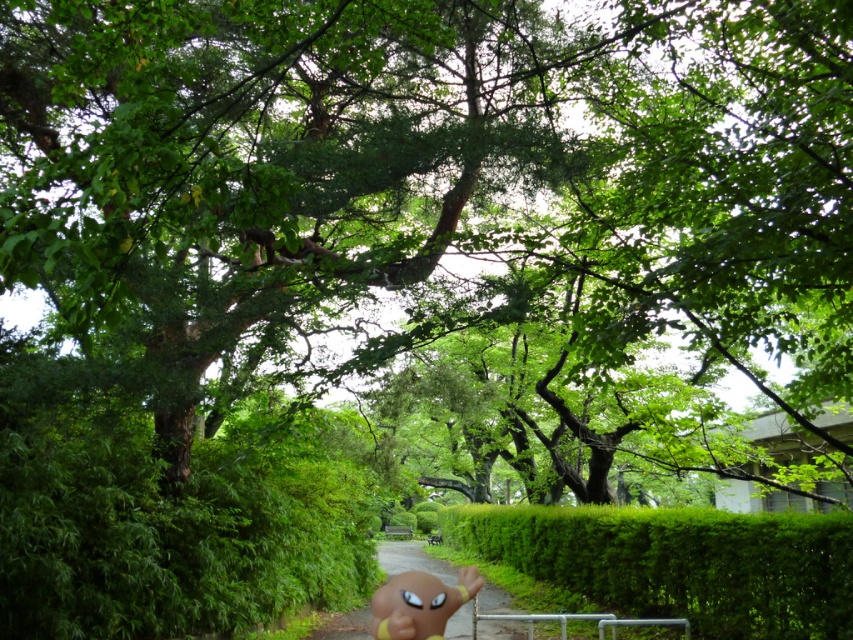
Does green leafy hedge at center appear on the right side of yellow rubber doll at lower center?

Correct, you'll find green leafy hedge at center to the right of yellow rubber doll at lower center.

Which of these two, green leafy hedge at center or yellow rubber doll at lower center, stands taller?

With more height is green leafy hedge at center.

This screenshot has width=853, height=640. What are the coordinates of `green leafy hedge at center` in the screenshot? It's located at (677, 563).

Between green leafy hedge at center and green grassy path at center, which one appears on the left side from the viewer's perspective?

green grassy path at center

Can you confirm if green leafy hedge at center is positioned to the left of green grassy path at center?

Incorrect, green leafy hedge at center is not on the left side of green grassy path at center.

Identify the location of green leafy hedge at center. (677, 563).

Who is positioned more to the left, green grassy path at center or yellow rubber doll at lower center?

From the viewer's perspective, green grassy path at center appears more on the left side.

Is point (491, 637) behind point (412, 637)?

Yes, point (491, 637) is behind point (412, 637).

Who is more forward, (453, 637) or (469, 593)?

Point (469, 593) is more forward.

The image size is (853, 640). I want to click on green grassy path at center, so coord(412,561).